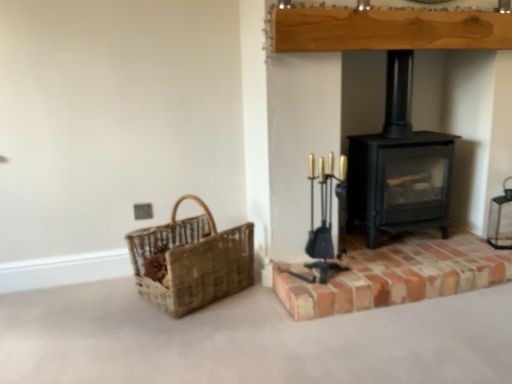
Question: Is woven natural basket at left surrounding black matte wood burning stove at center-right?

Choices:
 (A) yes
 (B) no

Answer: (B)

Question: Does woven natural basket at left have a lesser height compared to black matte wood burning stove at center-right?

Choices:
 (A) yes
 (B) no

Answer: (A)

Question: From the image's perspective, is woven natural basket at left under black matte wood burning stove at center-right?

Choices:
 (A) no
 (B) yes

Answer: (B)

Question: Can you confirm if woven natural basket at left is thinner than black matte wood burning stove at center-right?

Choices:
 (A) no
 (B) yes

Answer: (B)

Question: Is the position of woven natural basket at left less distant than that of black matte wood burning stove at center-right?

Choices:
 (A) no
 (B) yes

Answer: (B)

Question: Would you say black matte wood burning stove at center-right is to the left or to the right of brick at right in the picture?

Choices:
 (A) left
 (B) right

Answer: (A)

Question: Is point (393, 208) closer or farther from the camera than point (330, 309)?

Choices:
 (A) closer
 (B) farther

Answer: (B)

Question: From the image's perspective, is black matte wood burning stove at center-right above or below brick at right?

Choices:
 (A) above
 (B) below

Answer: (A)

Question: Based on their sizes in the image, would you say black matte wood burning stove at center-right is bigger or smaller than brick at right?

Choices:
 (A) small
 (B) big

Answer: (B)

Question: Considering the positions of point (356, 294) and point (389, 132), is point (356, 294) closer or farther from the camera than point (389, 132)?

Choices:
 (A) closer
 (B) farther

Answer: (A)

Question: From the image's perspective, is brick at right located above or below black matte wood burning stove at center-right?

Choices:
 (A) above
 (B) below

Answer: (B)

Question: Is brick at right to the left or to the right of black matte wood burning stove at center-right in the image?

Choices:
 (A) left
 (B) right

Answer: (B)

Question: Looking at the image, does brick at right seem bigger or smaller compared to black matte wood burning stove at center-right?

Choices:
 (A) big
 (B) small

Answer: (B)

Question: In the image, is woven natural basket at left positioned in front of or behind black matte wood burning stove at center-right?

Choices:
 (A) behind
 (B) front

Answer: (B)

Question: Is woven natural basket at left bigger or smaller than black matte wood burning stove at center-right?

Choices:
 (A) small
 (B) big

Answer: (A)